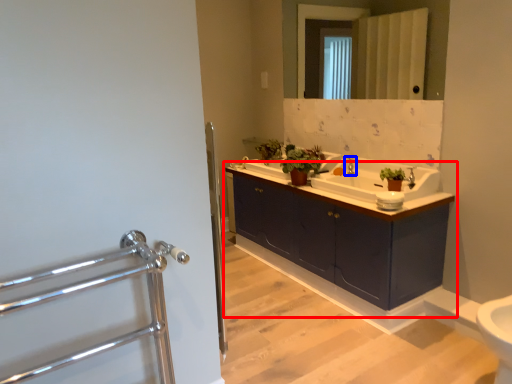
Question: Which object is further to the camera taking this photo, bathroom cabinet (highlighted by a red box) or tap (highlighted by a blue box)?

Choices:
 (A) bathroom cabinet
 (B) tap

Answer: (B)